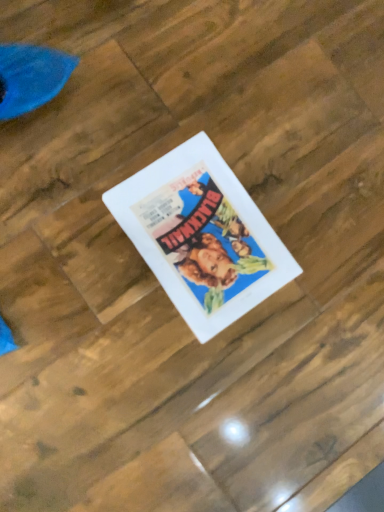
Locate an element on the screen. space that is in front of white paper at center is located at coordinates (119, 342).